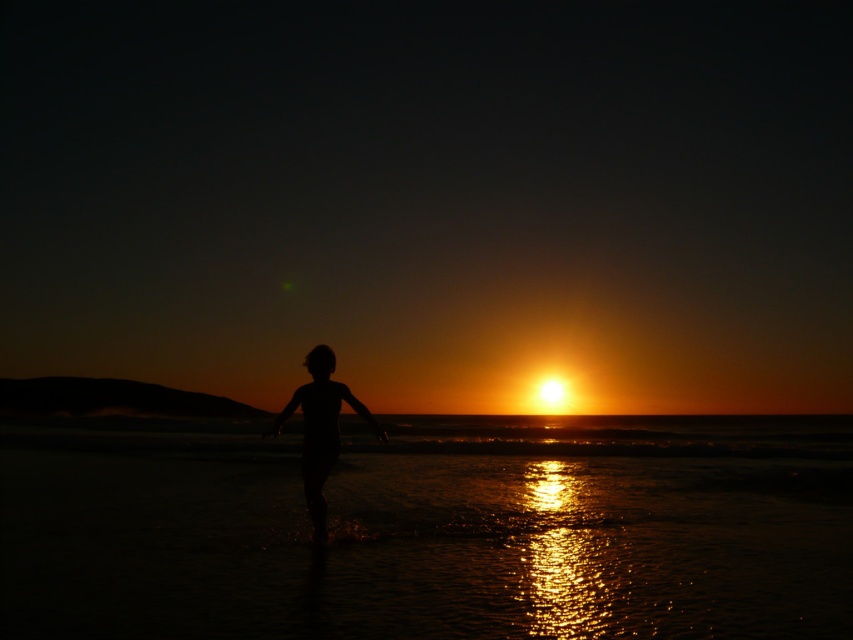
Question: Is shiny golden water at center to the left of silhouette skin at center from the viewer's perspective?

Choices:
 (A) yes
 (B) no

Answer: (B)

Question: Is shiny golden water at center bigger than silhouette skin at center?

Choices:
 (A) yes
 (B) no

Answer: (A)

Question: Is shiny golden water at center positioned before silhouette skin at center?

Choices:
 (A) no
 (B) yes

Answer: (B)

Question: Among these points, which one is farthest from the camera?

Choices:
 (A) (405, 452)
 (B) (317, 410)

Answer: (A)